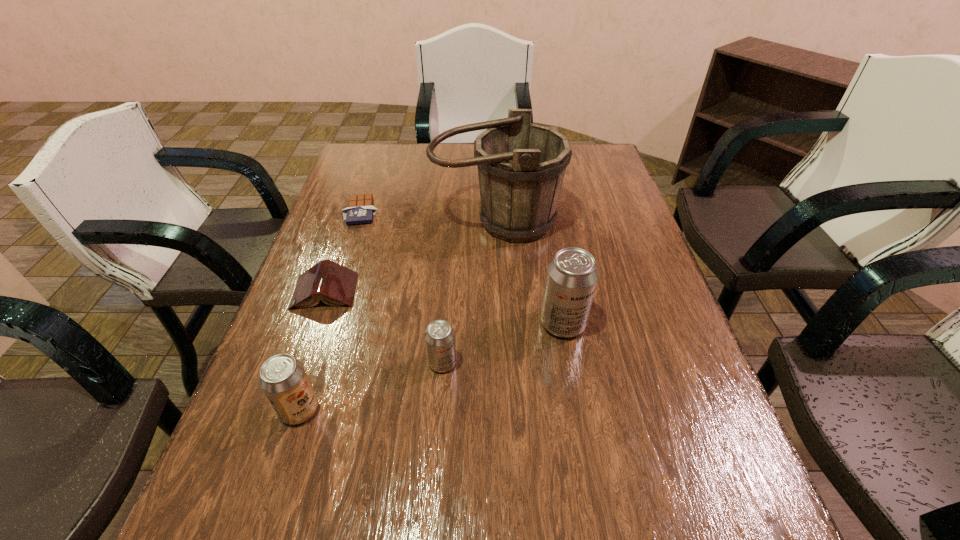
Considering the uniform spacing of beer cans, where should an additional beer can be positioned on the right? Please locate a free spot. Please provide its 2D coordinates. Your answer should be formatted as a tuple, i.e. [(x, y)], where the tuple contains the x and y coordinates of a point satisfying the conditions above.

[(666, 289)]